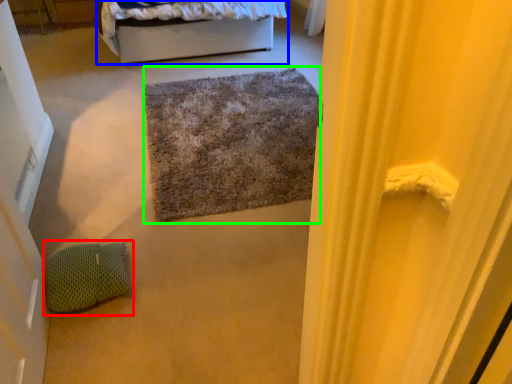
Question: Estimate the real-world distances between objects in this image. Which object is closer to pillow (highlighted by a red box), bed (highlighted by a blue box) or doormat (highlighted by a green box)?

Choices:
 (A) bed
 (B) doormat

Answer: (B)